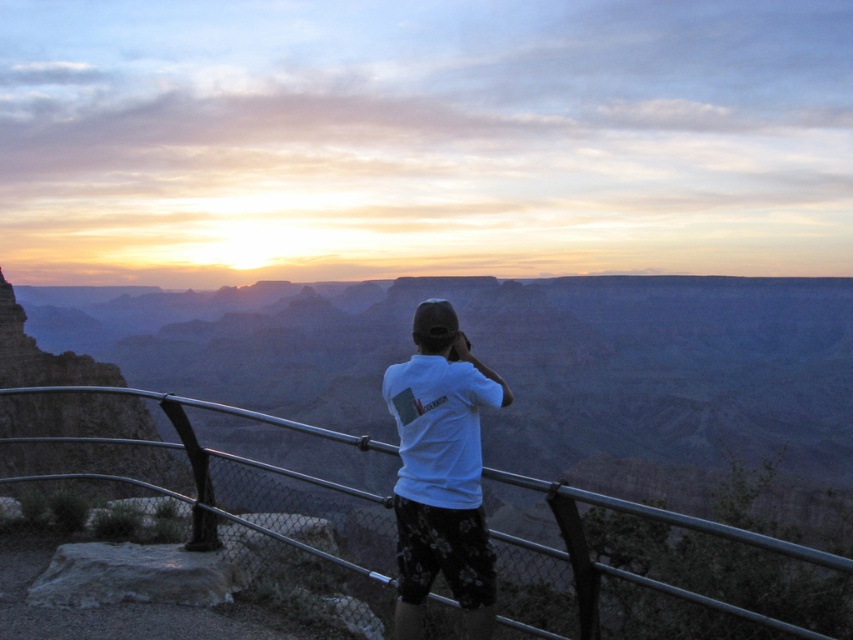
Question: Which of the following is the farthest from the observer?

Choices:
 (A) white cotton shirt at center
 (B) metallic gray rail at center

Answer: (A)

Question: Is white cotton shirt at center thinner than metallic gray rail at center?

Choices:
 (A) yes
 (B) no

Answer: (A)

Question: Can you confirm if white cotton shirt at center is smaller than metallic gray rail at center?

Choices:
 (A) no
 (B) yes

Answer: (B)

Question: Does white cotton shirt at center appear under metallic gray rail at center?

Choices:
 (A) no
 (B) yes

Answer: (A)

Question: Which object appears farthest from the camera in this image?

Choices:
 (A) metallic gray rail at center
 (B) white cotton shirt at center

Answer: (B)